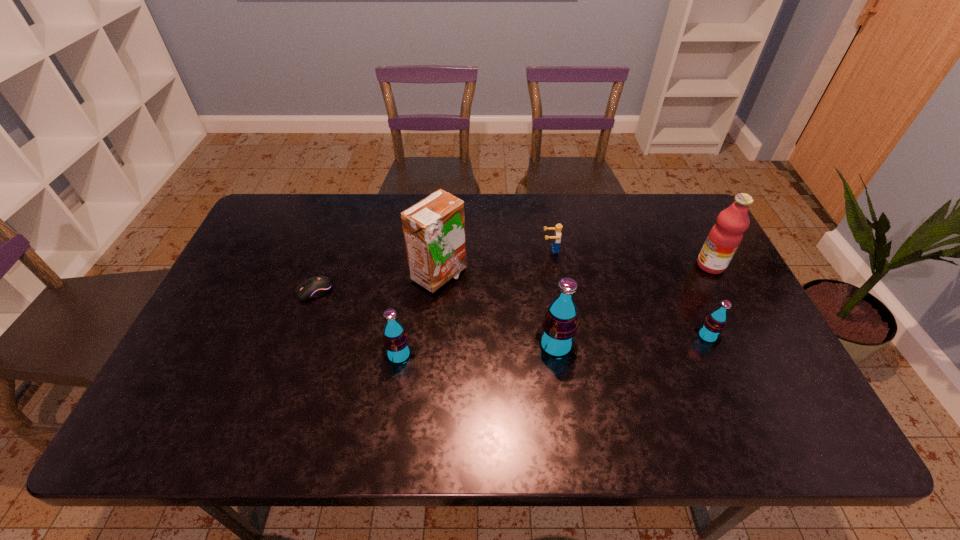
Given the evenly spaced sodas in the image, where should an extra soda be added on the left to preserve the spacing? Please point to a vacant space. Please provide its 2D coordinates. Your answer should be formatted as a tuple, i.e. [(x, y)], where the tuple contains the x and y coordinates of a point satisfying the conditions above.

[(236, 365)]